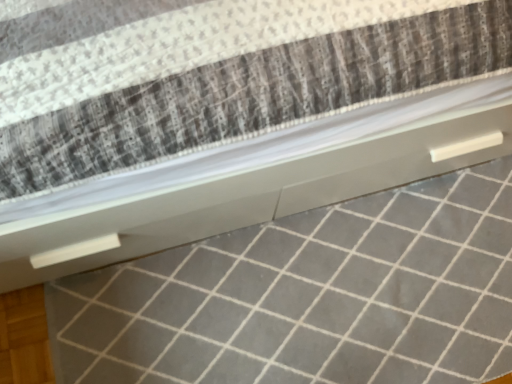
Locate an element on the screen. This screenshot has width=512, height=384. free point below white glossy tile at center (from a real-world perspective) is located at coordinates (331, 306).